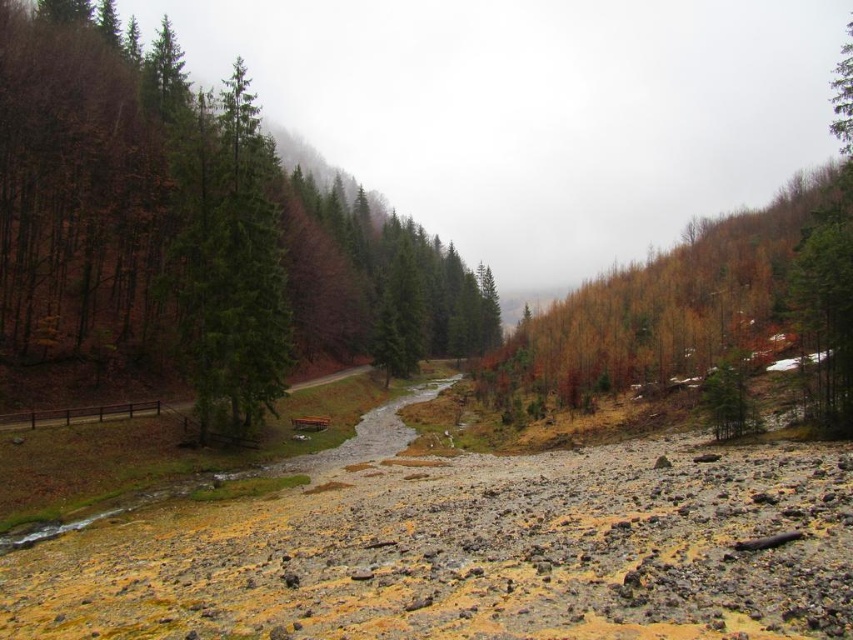
Which is above, green matte tree at left or green glossy tree at center?

green matte tree at left

Is green matte tree at left above green glossy tree at center?

Yes, green matte tree at left is above green glossy tree at center.

This screenshot has width=853, height=640. Identify the location of green matte tree at left. (190, 234).